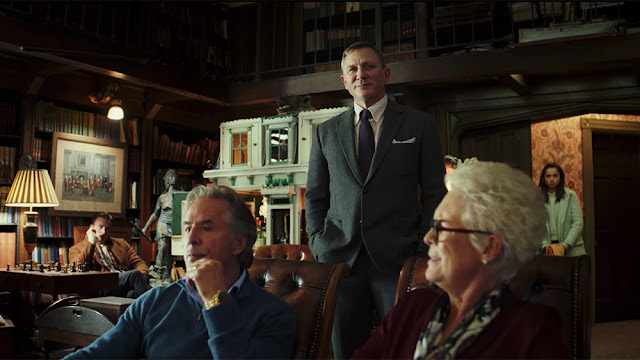
Where is `light`? Image resolution: width=640 pixels, height=360 pixels. light is located at coordinates (116, 113).